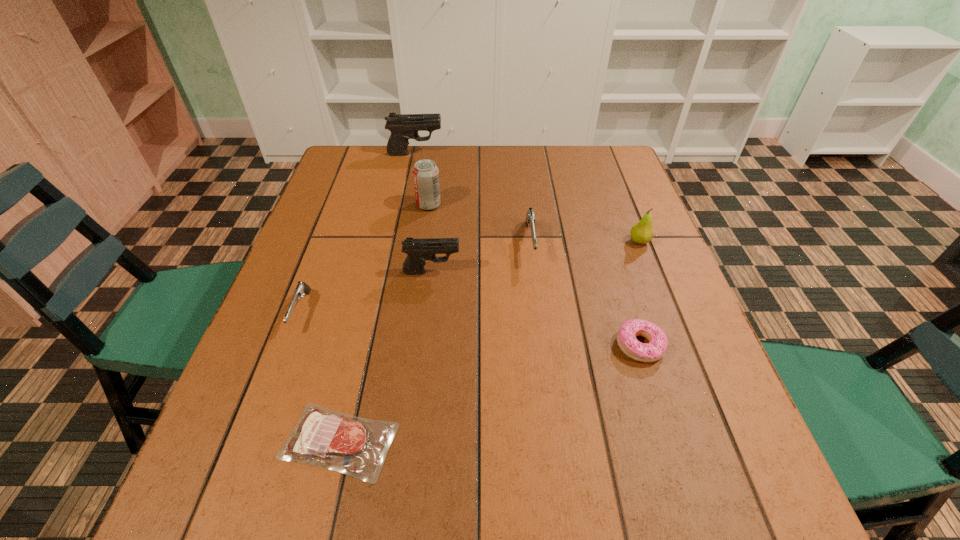
Find the location of a particular element. The height and width of the screenshot is (540, 960). free space between the pear and the farthest object is located at coordinates (527, 198).

The height and width of the screenshot is (540, 960). Find the location of `vacant space that is in between the right silver pistol and the soda can`. vacant space that is in between the right silver pistol and the soda can is located at coordinates (479, 224).

Find the location of `free spot between the third shortest object and the bigger black pistol`. free spot between the third shortest object and the bigger black pistol is located at coordinates (358, 233).

You are a GUI agent. You are given a task and a screenshot of the screen. Output one action in this format:
    pyautogui.click(x=<x>, y=<y>)
    Task: Click on the vacant area that lies between the gray soda can and the doughnut
    
    Given the screenshot: What is the action you would take?
    pyautogui.click(x=535, y=275)

Locate an element on the screen. free spot between the fourth shortest object and the second farthest object is located at coordinates (479, 224).

Where is `vacant area that lies between the left silver pistol and the third object from right to left`? vacant area that lies between the left silver pistol and the third object from right to left is located at coordinates pos(416,278).

Select which object appears as the third closest to the farthest pistol. Please provide its 2D coordinates. Your answer should be formatted as a tuple, i.e. [(x, y)], where the tuple contains the x and y coordinates of a point satisfying the conditions above.

[(418, 251)]

I want to click on object that is the fifth nearest to the nearest pistol, so click(x=403, y=127).

Where is `the third closest pistol to the pink doughnut`? the third closest pistol to the pink doughnut is located at coordinates (301, 288).

Point out which pistol is positioned as the nearest to the right silver pistol. Please provide its 2D coordinates. Your answer should be formatted as a tuple, i.e. [(x, y)], where the tuple contains the x and y coordinates of a point satisfying the conditions above.

[(418, 251)]